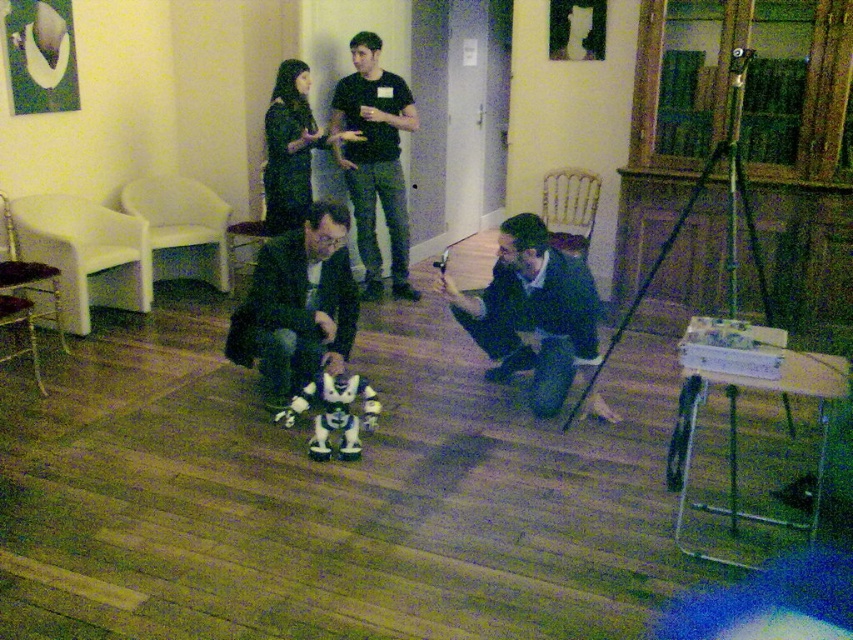
Question: Which point is closer to the camera taking this photo?

Choices:
 (A) (357, 237)
 (B) (315, 138)
 (C) (271, 259)

Answer: (C)

Question: Which point is closer to the camera?

Choices:
 (A) (311, 116)
 (B) (256, 321)
 (C) (552, 337)
 (D) (395, 280)

Answer: (B)

Question: Among these objects, which one is farthest from the camera?

Choices:
 (A) dark green fabric dress at upper center
 (B) black matte shirt at upper center
 (C) matte black suit at center

Answer: (B)

Question: From the image, what is the correct spatial relationship of dark blue sweater at lower center in relation to dark green fabric dress at upper center?

Choices:
 (A) right
 (B) left

Answer: (A)

Question: Does matte black suit at center appear over dark blue sweater at lower center?

Choices:
 (A) yes
 (B) no

Answer: (A)

Question: Can you confirm if dark blue sweater at lower center is smaller than black matte shirt at upper center?

Choices:
 (A) no
 (B) yes

Answer: (B)